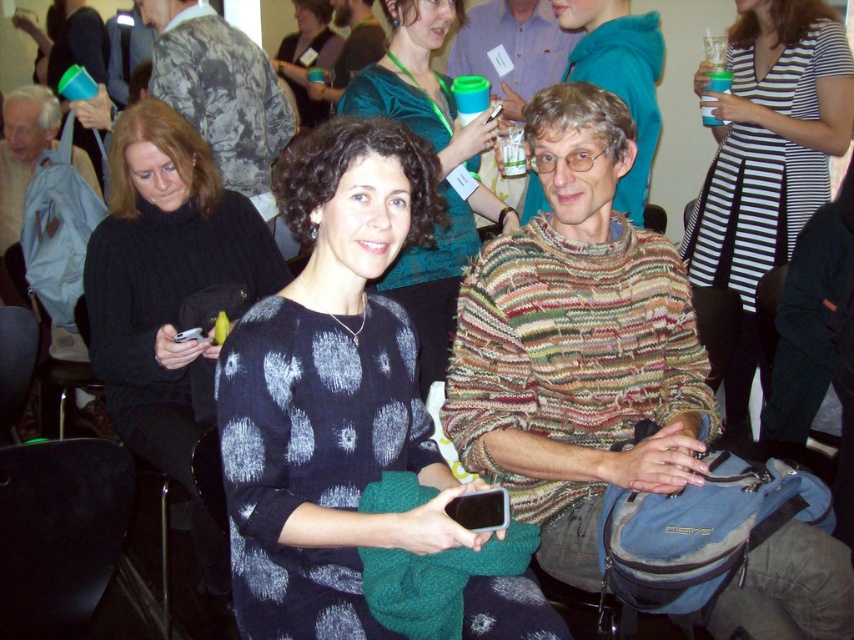
Question: Can you confirm if dark blue printed dress at center is positioned to the left of black knit sweater at center?

Choices:
 (A) no
 (B) yes

Answer: (A)

Question: Is black striped dress at upper center to the left of dark blue knit sweater at center from the viewer's perspective?

Choices:
 (A) yes
 (B) no

Answer: (B)

Question: Which point appears farthest from the camera in this image?

Choices:
 (A) pyautogui.click(x=727, y=204)
 (B) pyautogui.click(x=340, y=268)

Answer: (A)

Question: Can you confirm if dark blue printed dress at center is positioned below black knit sweater at center?

Choices:
 (A) no
 (B) yes

Answer: (B)

Question: Among these objects, which one is nearest to the camera?

Choices:
 (A) dark blue knit sweater at center
 (B) black knit sweater at center
 (C) matte black sweater at center

Answer: (B)

Question: Estimate the real-world distances between objects in this image. Which object is closer to the dark blue knit sweater at center?

Choices:
 (A) black striped dress at upper center
 (B) dark blue printed dress at center

Answer: (B)